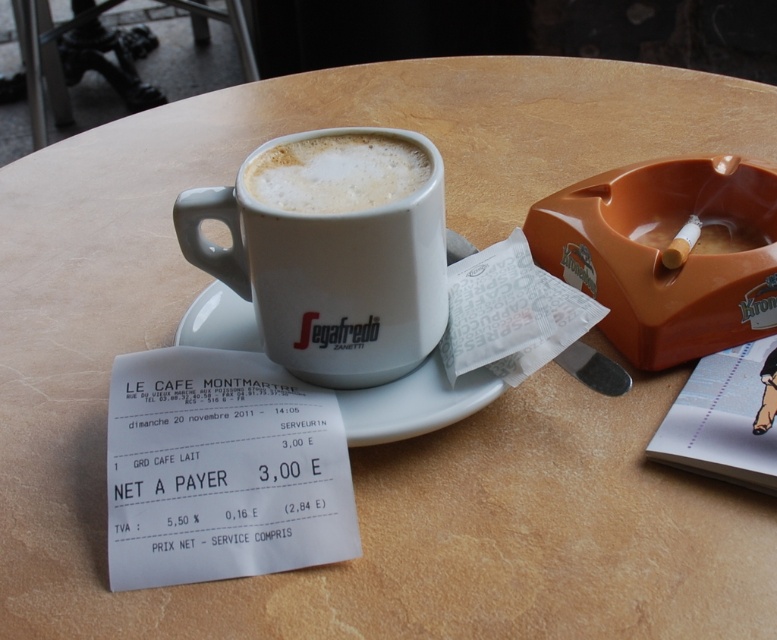
Is white ceramic mug at center further to camera compared to white frothy foam at center?

No, white ceramic mug at center is closer to the viewer.

Who is taller, white ceramic mug at center or white frothy foam at center?

Standing taller between the two is white ceramic mug at center.

Where is `white ceramic mug at center`? This screenshot has width=777, height=640. white ceramic mug at center is located at coordinates (328, 268).

Does white ceramic saucer at center have a lesser height compared to white frothy foam at center?

No.

Between point (476, 371) and point (375, 145), which one is positioned in front?

Positioned in front is point (476, 371).

Which is in front, point (185, 316) or point (288, 173)?

Positioned in front is point (288, 173).

I want to click on white ceramic saucer at center, so click(413, 403).

Does white ceramic mug at center appear over white ceramic saucer at center?

Correct, white ceramic mug at center is located above white ceramic saucer at center.

Does white ceramic mug at center have a lesser width compared to white ceramic saucer at center?

Correct, white ceramic mug at center's width is less than white ceramic saucer at center's.

Who is more distant from viewer, (438, 209) or (361, 428)?

The point (438, 209) is behind.

You are a GUI agent. You are given a task and a screenshot of the screen. Output one action in this format:
    pyautogui.click(x=<x>, y=<y>)
    Task: Click on the white ceramic mug at center
    
    Given the screenshot: What is the action you would take?
    pyautogui.click(x=328, y=268)